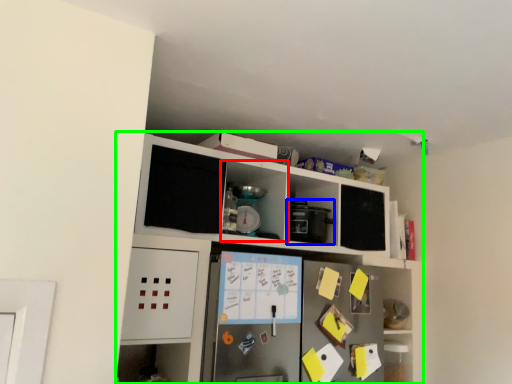
Question: Which is farther away from cabinet (highlighted by a red box)? appliance (highlighted by a blue box) or cabinetry (highlighted by a green box)?

Choices:
 (A) appliance
 (B) cabinetry

Answer: (B)